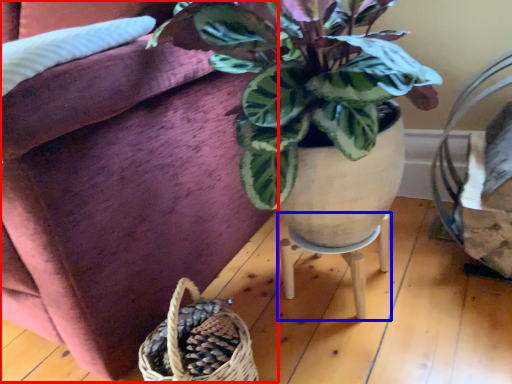
Question: Which point is closer to the camera, couch (highlighted by a red box) or table (highlighted by a blue box)?

Choices:
 (A) couch
 (B) table

Answer: (A)